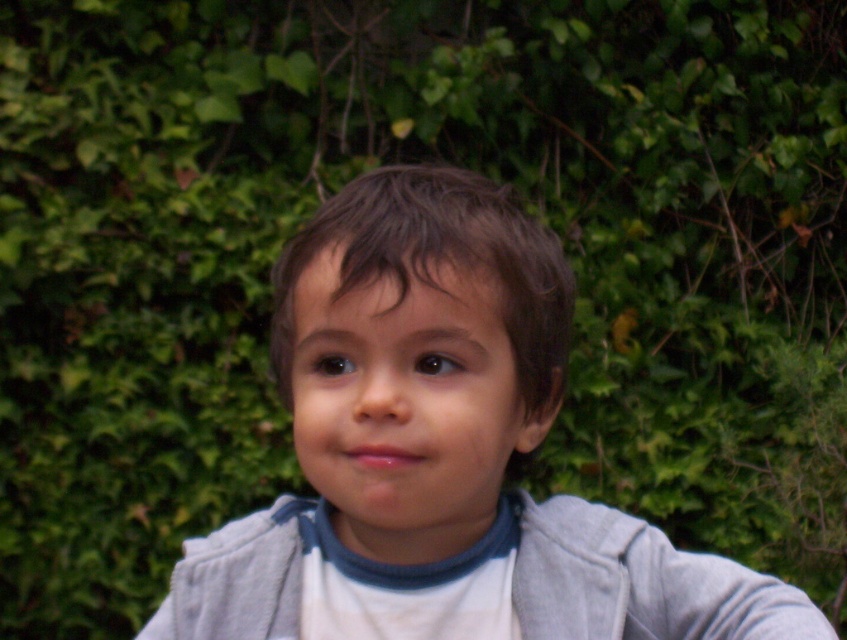
Does matte gray hoodie at center appear over gray fleece jacket at center?

Yes.

Does point (740, 624) come closer to viewer compared to point (213, 544)?

Yes, point (740, 624) is closer to viewer.

Where is `matte gray hoodie at center`? matte gray hoodie at center is located at coordinates (441, 451).